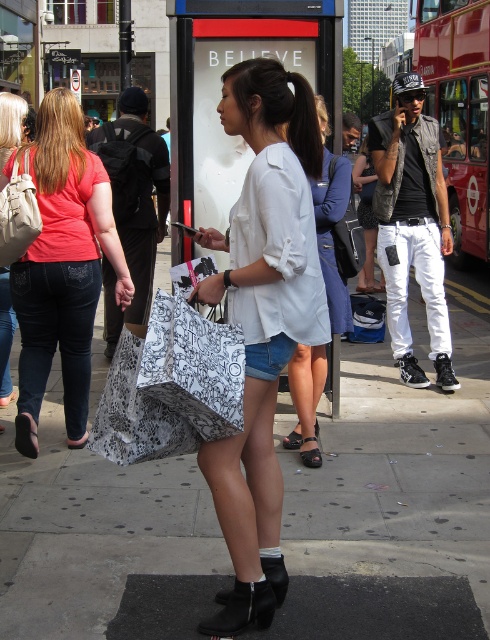
Question: From the image, what is the correct spatial relationship of denim jeans at center in relation to black suede boot at lower center?

Choices:
 (A) above
 (B) below

Answer: (A)

Question: Is the position of red metallic bus at upper right less distant than that of matte pink shirt at left?

Choices:
 (A) no
 (B) yes

Answer: (A)

Question: Is white printed paper bag at center further to camera compared to light blue denim shorts at center?

Choices:
 (A) yes
 (B) no

Answer: (B)

Question: Estimate the real-world distances between objects in this image. Which object is closer to the white cotton shirt at center?

Choices:
 (A) smooth concrete pavement at center
 (B) black suede boot at lower center
 (C) red metallic bus at upper right
 (D) black fabric sandal at lower center

Answer: (B)

Question: Estimate the real-world distances between objects in this image. Which object is closer to the smooth concrete pavement at center?

Choices:
 (A) matte black jacket at center
 (B) white printed paper bag at center
 (C) black fabric sandal at lower center
 (D) black fabric sandal at lower left

Answer: (C)

Question: Estimate the real-world distances between objects in this image. Which object is closer to the black fabric sandal at lower left?

Choices:
 (A) matte black jacket at center
 (B) black hair at center

Answer: (B)